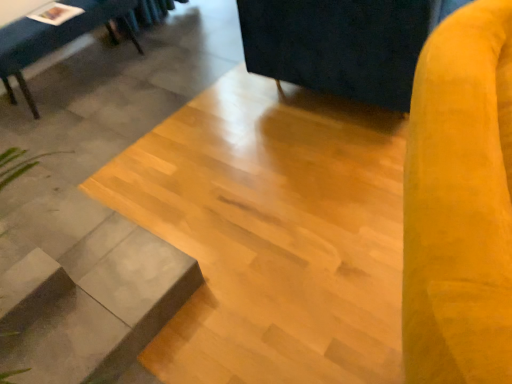
Question: Does matte black table at upper left have a lesser width compared to velvet yellow swivel chair at right, which is counted as the first swivel chair, starting from the front?

Choices:
 (A) no
 (B) yes

Answer: (A)

Question: Is matte black table at upper left closer to the viewer compared to velvet yellow swivel chair at right, which is the 2th swivel chair from top to bottom?

Choices:
 (A) no
 (B) yes

Answer: (A)

Question: From a real-world perspective, does matte black table at upper left sit lower than velvet yellow swivel chair at right, acting as the second swivel chair starting from the back?

Choices:
 (A) no
 (B) yes

Answer: (B)

Question: From the image's perspective, is matte black table at upper left beneath velvet yellow swivel chair at right, which is counted as the first swivel chair, starting from the front?

Choices:
 (A) no
 (B) yes

Answer: (A)

Question: Is matte black table at upper left looking in the opposite direction of velvet yellow swivel chair at right, which is counted as the first swivel chair, starting from the front?

Choices:
 (A) yes
 (B) no

Answer: (B)

Question: Can we say matte black table at upper left lies outside velvet yellow swivel chair at right, which is the 2th swivel chair from top to bottom?

Choices:
 (A) yes
 (B) no

Answer: (A)

Question: Is gray concrete at lower left oriented away from velvet yellow swivel chair at right, which is the 2th swivel chair from top to bottom?

Choices:
 (A) yes
 (B) no

Answer: (B)

Question: Considering the relative sizes of gray concrete at lower left and velvet yellow swivel chair at right, which is the 2th swivel chair from top to bottom, in the image provided, is gray concrete at lower left smaller than velvet yellow swivel chair at right, which is the 2th swivel chair from top to bottom,?

Choices:
 (A) no
 (B) yes

Answer: (B)

Question: Are gray concrete at lower left and velvet yellow swivel chair at right, acting as the second swivel chair starting from the back, beside each other?

Choices:
 (A) yes
 (B) no

Answer: (B)

Question: Considering the relative sizes of gray concrete at lower left and velvet yellow swivel chair at right, acting as the second swivel chair starting from the back, in the image provided, is gray concrete at lower left bigger than velvet yellow swivel chair at right, acting as the second swivel chair starting from the back,?

Choices:
 (A) yes
 (B) no

Answer: (B)

Question: Does gray concrete at lower left have a lesser height compared to velvet yellow swivel chair at right, which is counted as the first swivel chair, starting from the front?

Choices:
 (A) no
 (B) yes

Answer: (B)

Question: Does gray concrete at lower left come in front of velvet yellow swivel chair at right, marked as the 1th swivel chair in a bottom-to-top arrangement?

Choices:
 (A) yes
 (B) no

Answer: (B)

Question: Considering the relative positions of gray concrete at lower left and velvet yellow swivel chair at right, the 1th swivel chair viewed from the back, in the image provided, is gray concrete at lower left to the right of velvet yellow swivel chair at right, the 1th swivel chair viewed from the back, from the viewer's perspective?

Choices:
 (A) yes
 (B) no

Answer: (B)